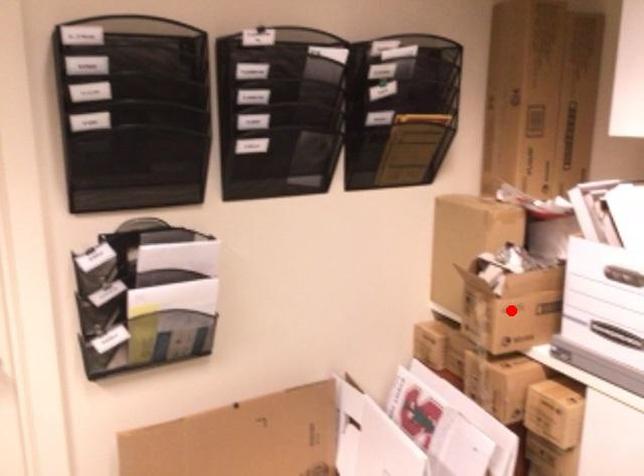
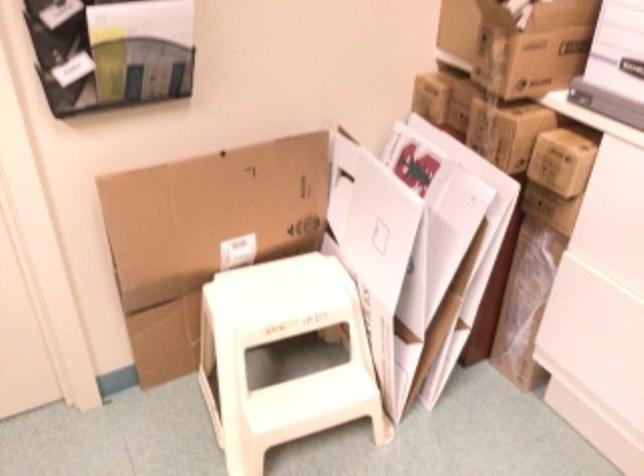
In the second image, find the point that corresponds to the highlighted location in the first image.

(532, 46)